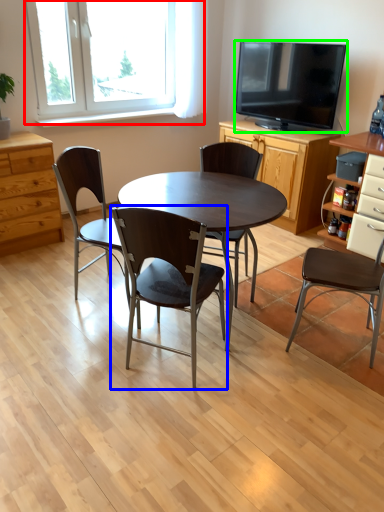
Question: Which object is positioned farthest from window (highlighted by a red box)? Select from chair (highlighted by a blue box) and television (highlighted by a green box).

Choices:
 (A) chair
 (B) television

Answer: (A)